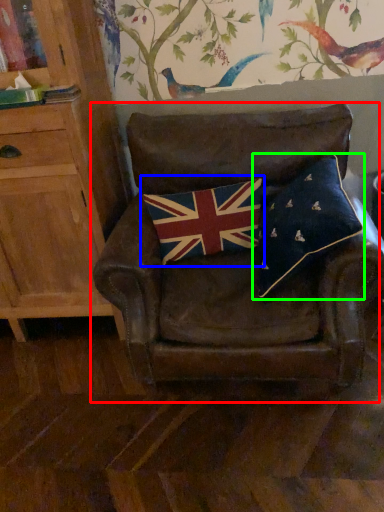
Question: Considering the real-world distances, which object is farthest from chair (highlighted by a red box)? flag (highlighted by a blue box) or pillow (highlighted by a green box)?

Choices:
 (A) flag
 (B) pillow

Answer: (B)